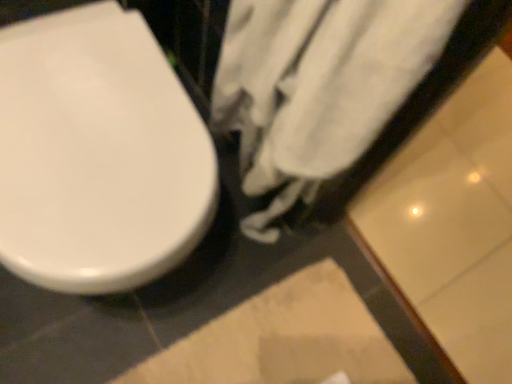
Question: Is white glossy toilet seat at left bigger than white cotton towel at center?

Choices:
 (A) yes
 (B) no

Answer: (A)

Question: Does white glossy toilet seat at left turn towards white cotton towel at center?

Choices:
 (A) no
 (B) yes

Answer: (A)

Question: Does white glossy toilet seat at left touch white cotton towel at center?

Choices:
 (A) no
 (B) yes

Answer: (A)

Question: Does white glossy toilet seat at left have a lesser height compared to white cotton towel at center?

Choices:
 (A) yes
 (B) no

Answer: (A)

Question: Considering the relative positions of white glossy toilet seat at left and white cotton towel at center in the image provided, is white glossy toilet seat at left behind white cotton towel at center?

Choices:
 (A) yes
 (B) no

Answer: (A)

Question: From a real-world perspective, relative to white glossy toilet seat at left, is beige textured rug at lower center vertically above or below?

Choices:
 (A) above
 (B) below

Answer: (B)

Question: Is point (193, 377) positioned closer to the camera than point (155, 210)?

Choices:
 (A) farther
 (B) closer

Answer: (A)

Question: In the image, is beige textured rug at lower center positioned in front of or behind white glossy toilet seat at left?

Choices:
 (A) behind
 (B) front

Answer: (A)

Question: From the image's perspective, is beige textured rug at lower center positioned above or below white glossy toilet seat at left?

Choices:
 (A) below
 (B) above

Answer: (A)

Question: From a real-world perspective, relative to white cotton towel at center, is white glossy toilet seat at left vertically above or below?

Choices:
 (A) below
 (B) above

Answer: (A)

Question: In terms of size, does white glossy toilet seat at left appear bigger or smaller than white cotton towel at center?

Choices:
 (A) big
 (B) small

Answer: (A)

Question: Is white glossy toilet seat at left taller or shorter than white cotton towel at center?

Choices:
 (A) tall
 (B) short

Answer: (B)

Question: Does point (174, 147) appear closer or farther from the camera than point (257, 13)?

Choices:
 (A) farther
 (B) closer

Answer: (A)

Question: From a real-world perspective, relative to beige textured rug at lower center, is white cotton towel at center vertically above or below?

Choices:
 (A) below
 (B) above

Answer: (B)

Question: Is point click(252, 109) positioned closer to the camera than point click(266, 319)?

Choices:
 (A) closer
 (B) farther

Answer: (A)